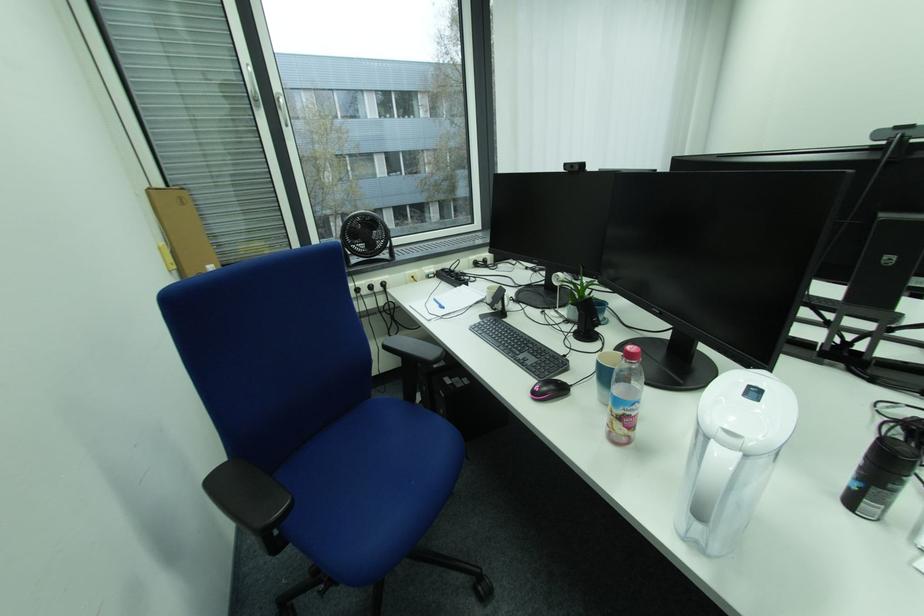
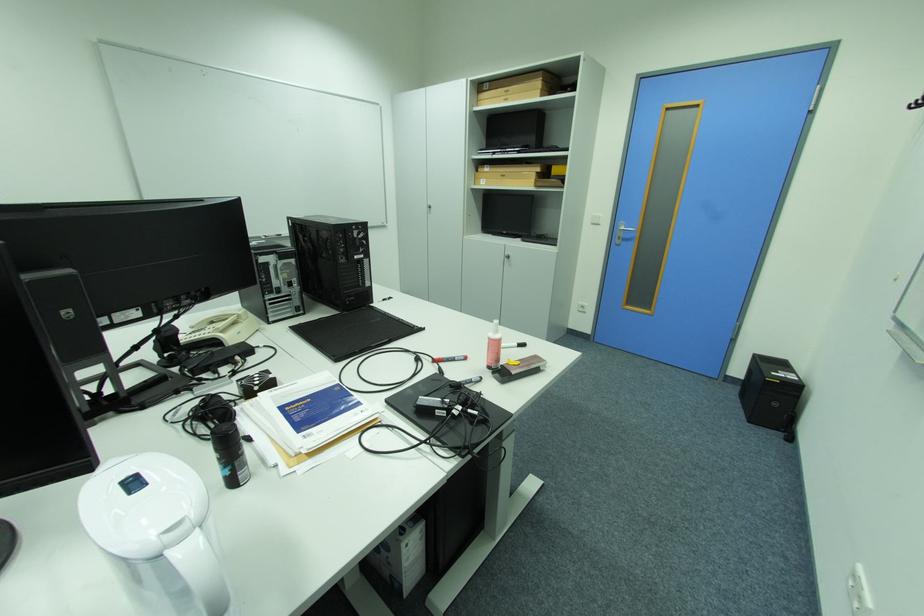
The point at (720, 440) is marked in the first image. Where is the corresponding point in the second image?

(175, 554)